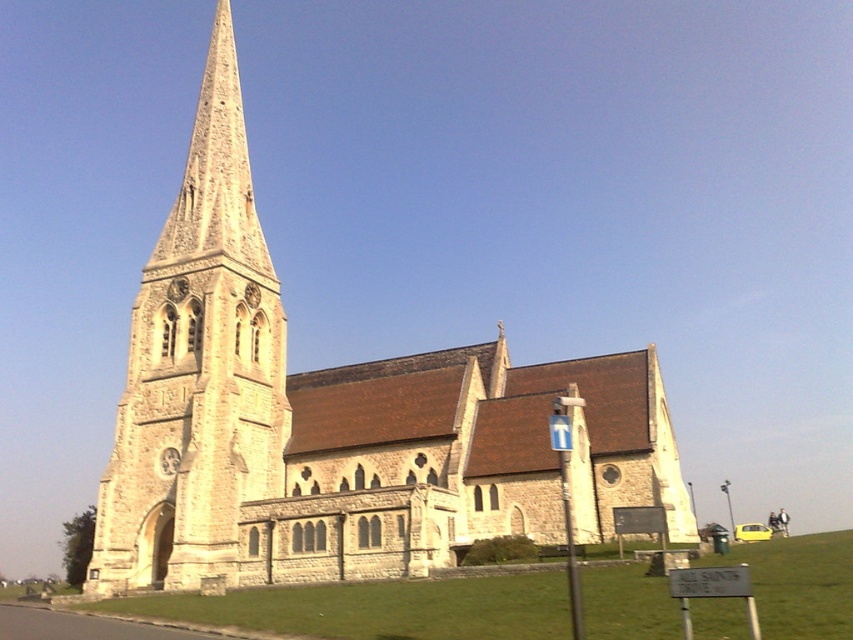
Question: Can you confirm if stone steeple at center is positioned below green grass at lower center?

Choices:
 (A) no
 (B) yes

Answer: (A)

Question: Which of these objects is positioned closest to the green grass at lower center?

Choices:
 (A) stone steeple at center
 (B) light beige stone church at center

Answer: (B)

Question: Can you confirm if light beige stone church at center is positioned to the right of stone steeple at center?

Choices:
 (A) no
 (B) yes

Answer: (B)

Question: Can you confirm if stone steeple at center is bigger than green grass at lower center?

Choices:
 (A) yes
 (B) no

Answer: (A)

Question: Estimate the real-world distances between objects in this image. Which object is farther from the stone steeple at center?

Choices:
 (A) light beige stone church at center
 (B) green grass at lower center

Answer: (B)

Question: Among these points, which one is nearest to the camera?

Choices:
 (A) (735, 600)
 (B) (202, 440)
 (C) (389, 476)

Answer: (A)